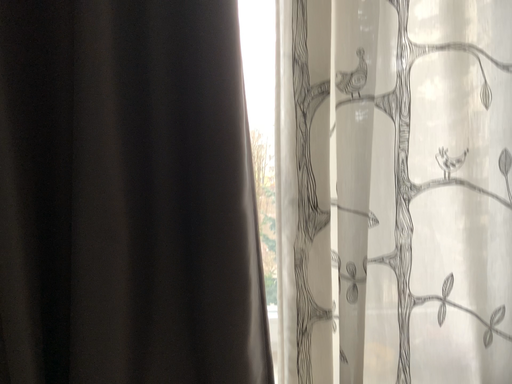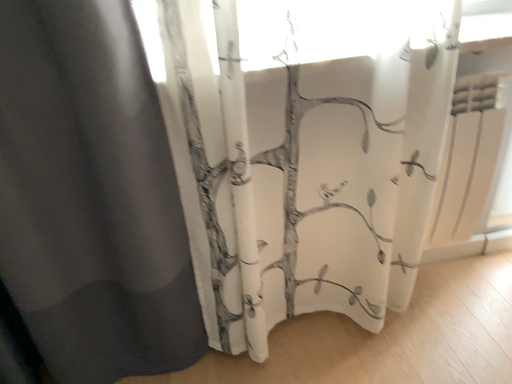
Question: How did the camera likely rotate when shooting the video?

Choices:
 (A) rotated left
 (B) rotated right

Answer: (B)